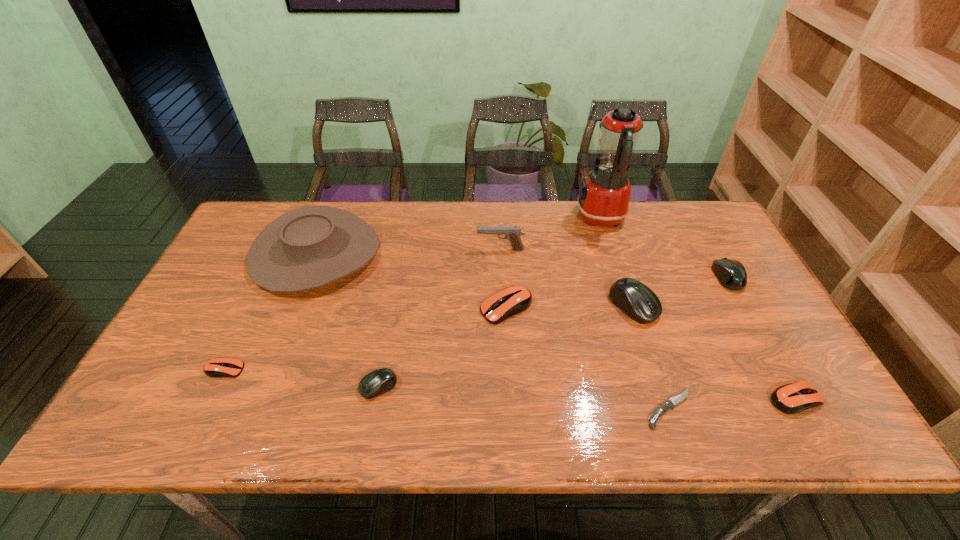
At what (x,y) coordinates should I click in order to perform the action: click on the nearest black mouse. Please return your answer as a coordinate pair (x, y). The width and height of the screenshot is (960, 540). Looking at the image, I should click on (379, 381).

Locate an element on the screen. The height and width of the screenshot is (540, 960). the second biggest orange computer mouse is located at coordinates (793, 398).

At what (x,y) coordinates should I click in order to perform the action: click on the rightmost orange computer mouse. Please return your answer as a coordinate pair (x, y). Looking at the image, I should click on (793, 398).

Locate an element on the screen. The width and height of the screenshot is (960, 540). the shortest computer mouse is located at coordinates (217, 367).

Identify the location of the second shortest object. click(x=217, y=367).

Locate an element on the screen. Image resolution: width=960 pixels, height=540 pixels. pocketknife is located at coordinates (669, 404).

Where is `free region located on the controls of the food processor`? free region located on the controls of the food processor is located at coordinates (526, 218).

Locate an element on the screen. This screenshot has width=960, height=540. vacant space located on the controls of the food processor is located at coordinates (508, 218).

Find the location of `vacant region located on the controls of the food processor`. vacant region located on the controls of the food processor is located at coordinates (540, 218).

Locate an element on the screen. The width and height of the screenshot is (960, 540). blank space located 0.340m on the front of the cowboy hat is located at coordinates (252, 414).